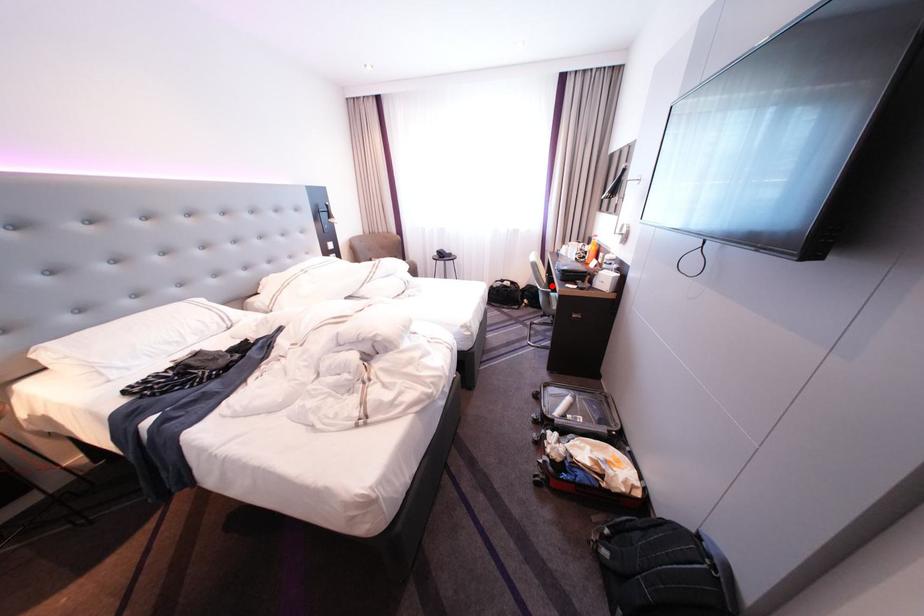
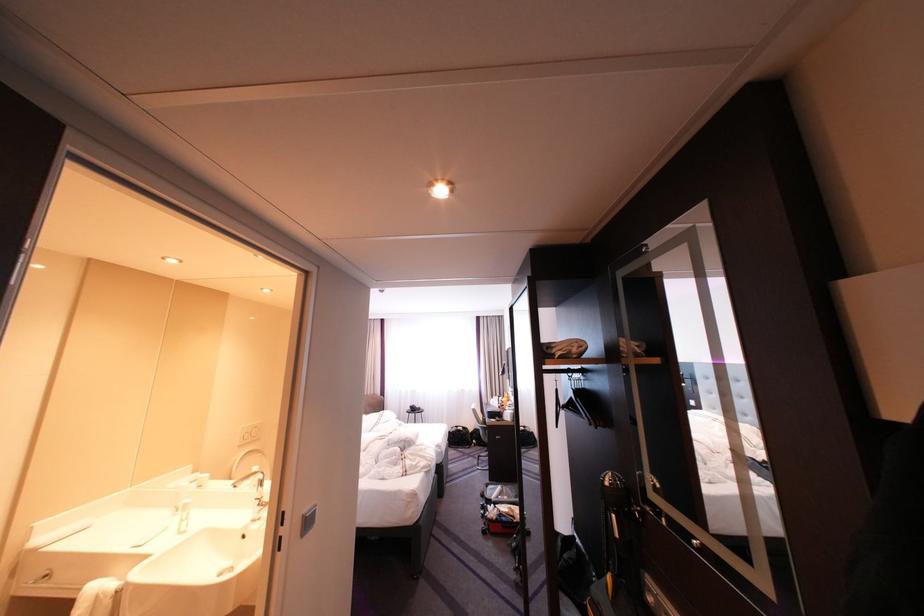
Locate, in the second image, the point that corresponds to the highlighted location in the first image.

(491, 424)